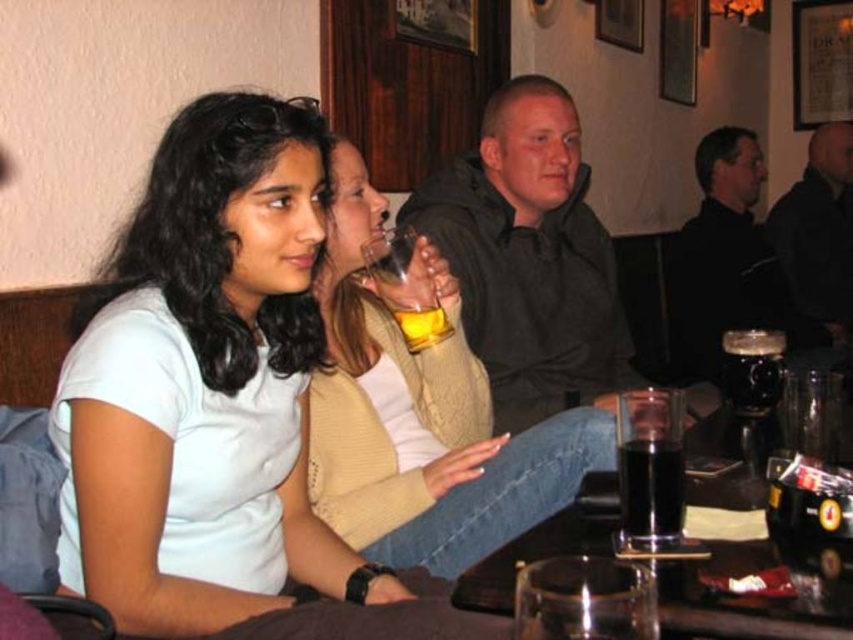
Question: Is knitted beige sweater at center positioned before black matte glass mug at upper right?

Choices:
 (A) yes
 (B) no

Answer: (A)

Question: Which object is positioned closest to the white matte shirt at center?

Choices:
 (A) knitted beige sweater at center
 (B) dark glass at lower center

Answer: (A)

Question: Observing the image, what is the correct spatial positioning of black matte jacket at upper right in reference to dark glass at lower center?

Choices:
 (A) above
 (B) below

Answer: (A)

Question: Which is farther from the black matte glass mug at upper right?

Choices:
 (A) dark glass at lower center
 (B) black matte jacket at upper right
 (C) knitted beige sweater at center
 (D) white matte shirt at center

Answer: (A)

Question: Among these objects, which one is farthest from the camera?

Choices:
 (A) white matte shirt at center
 (B) black matte glass mug at upper right
 (C) dark gray hoodie at center

Answer: (B)

Question: Does knitted beige sweater at center have a smaller size compared to black matte jacket at upper right?

Choices:
 (A) yes
 (B) no

Answer: (A)